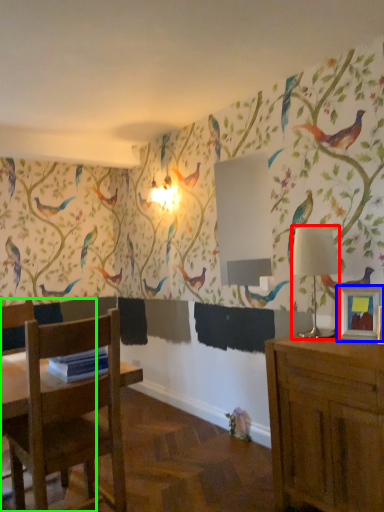
Question: Based on their relative distances, which object is nearer to lamp (highlighted by a red box)? Choose from picture frame (highlighted by a blue box) and chair (highlighted by a green box).

Choices:
 (A) picture frame
 (B) chair

Answer: (A)